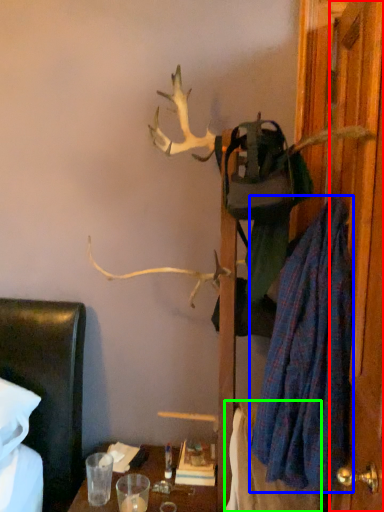
Question: Estimate the real-world distances between objects in this image. Which object is farther from door (highlighted by a red box), robe (highlighted by a blue box) or blanket (highlighted by a green box)?

Choices:
 (A) robe
 (B) blanket

Answer: (B)